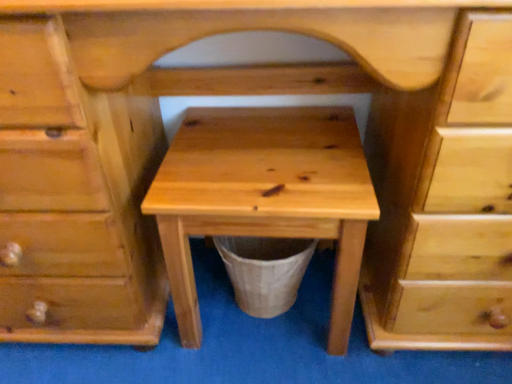
This screenshot has width=512, height=384. What do you see at coordinates (264, 195) in the screenshot? I see `natural wood stool at center` at bounding box center [264, 195].

At what (x,y) coordinates should I click in order to perform the action: click on natural wood stool at center. Please return your answer as a coordinate pair (x, y). The image size is (512, 384). Looking at the image, I should click on (264, 195).

Find the location of `natural wood stool at center`. natural wood stool at center is located at coordinates (264, 195).